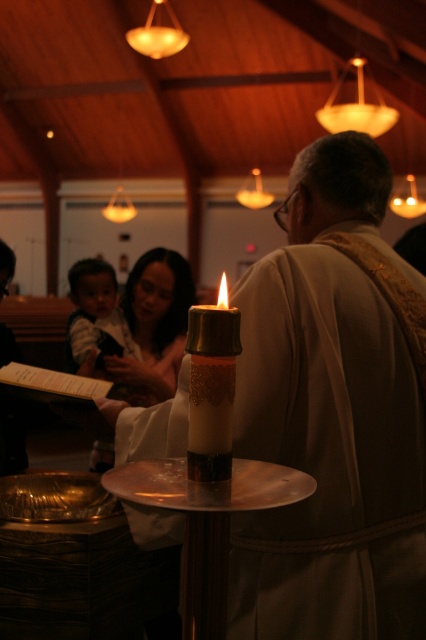
You are an interior designer planning to place a new decorative item in the church scene. The item must be placed between the matte gold robe at center and the gold glitter candle at center. Which object should the new item be placed closer to, considering their sizes?

The new item should be placed closer to the gold glitter candle at center because the matte gold robe at center is larger in size than the gold glitter candle at center, so there is more space between them near the smaller candle.

In the church scene, there is a matte gold robe at center and a gold glitter candle at center. Based on their positions, which object is located to the right side of the other?

The matte gold robe at center is positioned to the right of the gold glitter candle at center.